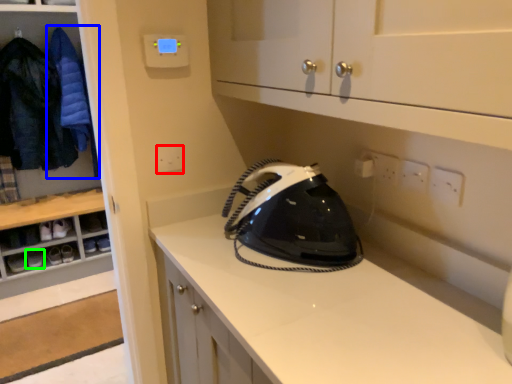
Question: Which is farther away from electric outlet (highlighted by a red box)? clothing (highlighted by a blue box) or footwear (highlighted by a green box)?

Choices:
 (A) clothing
 (B) footwear

Answer: (B)